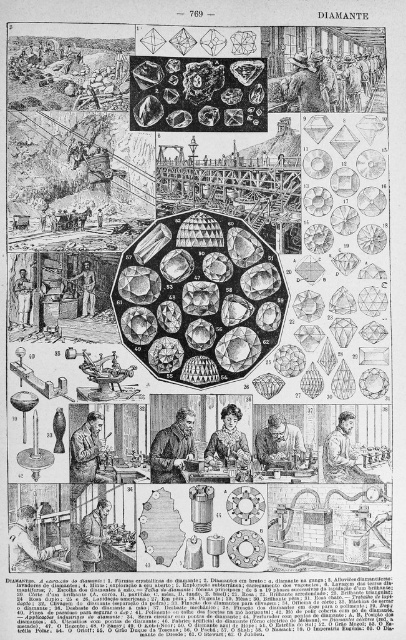
Based on the photo, is black leather jacket at center below wooden figure at center?

Indeed, black leather jacket at center is positioned under wooden figure at center.

Is point (174, 422) positioned in front of point (28, 292)?

Yes, point (174, 422) is closer to viewer.

I want to click on black leather jacket at center, so click(172, 449).

Is the position of light brown wood at lower left more distant than that of smooth skin face at center?

That is True.

Consider the image. Between light brown wood at lower left and smooth skin face at center, which one appears on the left side from the viewer's perspective?

light brown wood at lower left

Which is in front, point (30, 536) or point (226, 404)?

Positioned in front is point (226, 404).

Image resolution: width=406 pixels, height=640 pixels. Find the location of `light brown wood at lower left`. light brown wood at lower left is located at coordinates (27, 541).

Is smooth wooden hand at center to the left of wooden crate at center from the viewer's perspective?

No, smooth wooden hand at center is not to the left of wooden crate at center.

Is point (256, 444) positioned before point (82, 285)?

Yes, it is.

What do you see at coordinates (278, 444) in the screenshot? I see `smooth wooden hand at center` at bounding box center [278, 444].

Identify the location of smooth wooden hand at center. (278, 444).